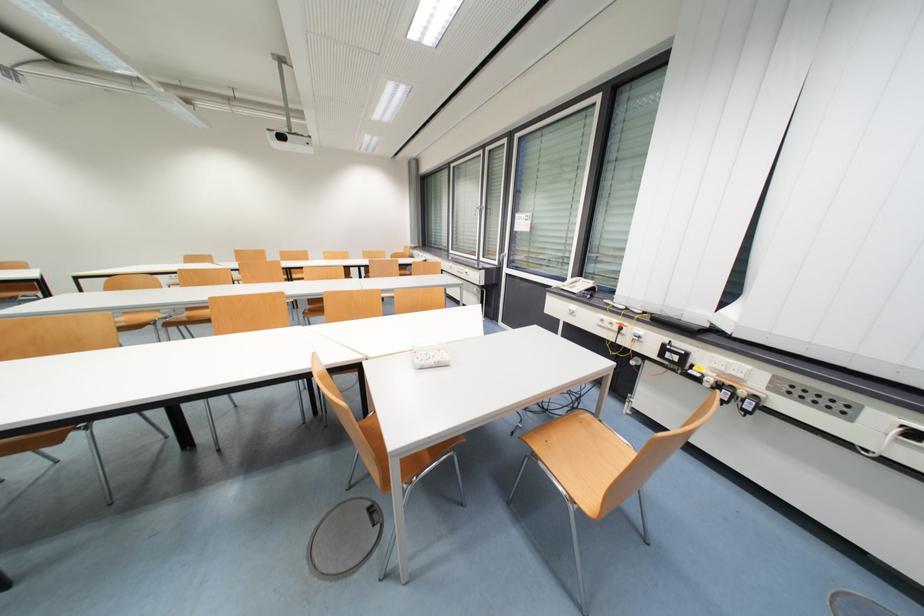
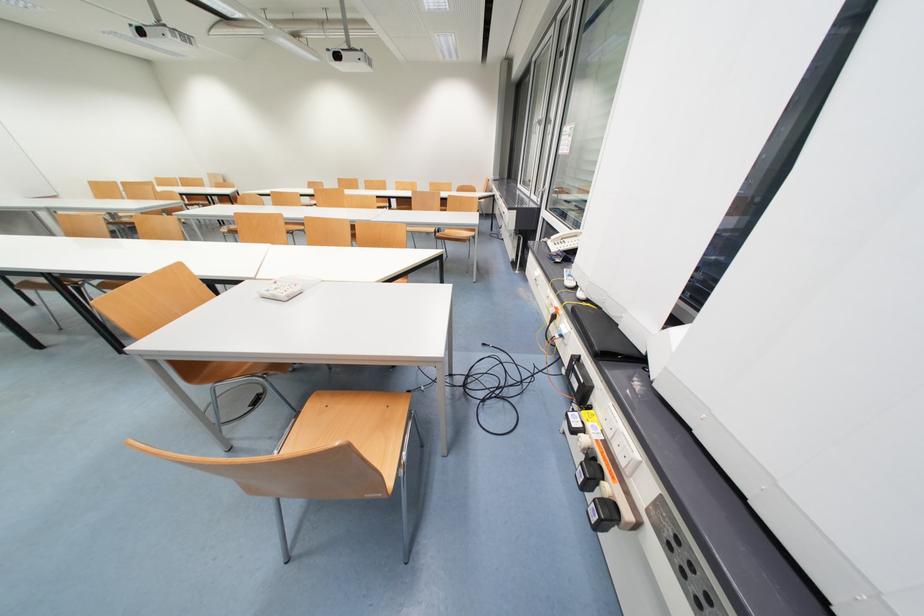
Find the pixel in the second image that matches pixel 444 363 in the first image.

(280, 297)